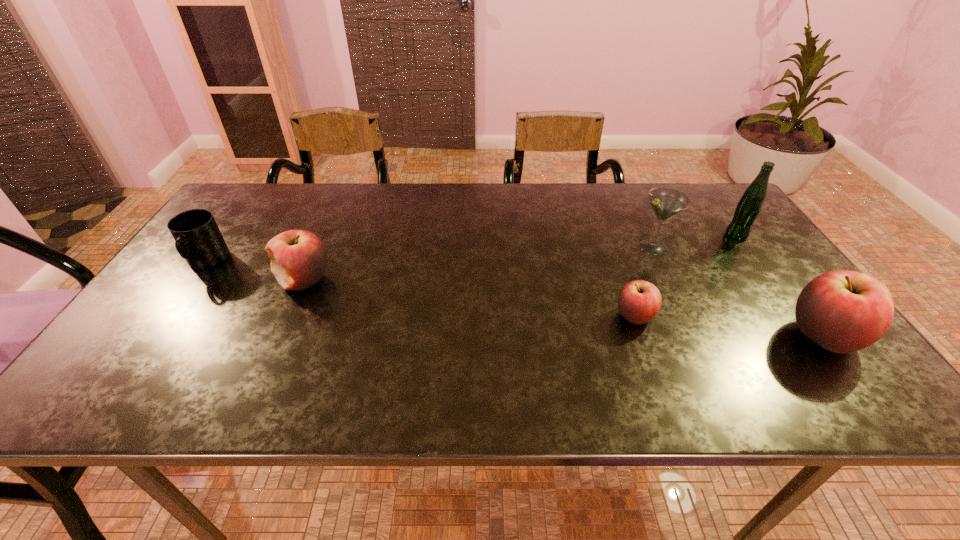
The width and height of the screenshot is (960, 540). Find the location of `the leftmost apple`. the leftmost apple is located at coordinates (298, 258).

This screenshot has width=960, height=540. I want to click on the second shortest apple, so tap(298, 258).

Locate an element on the screen. the shortest object is located at coordinates click(x=639, y=301).

At what (x,y) coordinates should I click in order to perform the action: click on the fourth object from right to left. Please return your answer as a coordinate pair (x, y). Looking at the image, I should click on (639, 301).

The image size is (960, 540). In order to click on the rightmost apple in this screenshot , I will do `click(843, 311)`.

Find the location of a particular element. beer bottle is located at coordinates (748, 208).

Find the location of a particular element. The height and width of the screenshot is (540, 960). the leftmost object is located at coordinates (198, 239).

The image size is (960, 540). I want to click on the second shortest object, so click(x=198, y=239).

Find the location of a particular element. The height and width of the screenshot is (540, 960). the third object from right to left is located at coordinates (666, 203).

Find the location of a particular element. The height and width of the screenshot is (540, 960). vacant space located on the right of the leftmost apple is located at coordinates (355, 280).